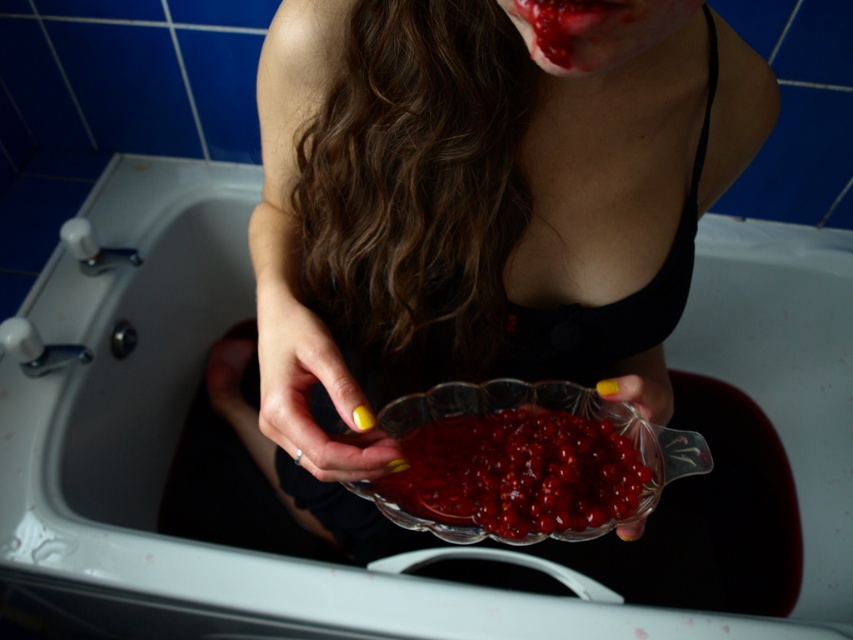
You are an interior designer working on a bathroom renovation project. You want to place a glossy glass bowl at center in the bathroom. Based on the scene description, where should you position it?

You should position the glossy glass bowl at center at point (517, 476).

You are a photographer setting up a shoot in this bathroom scene. You need to position a light source to illuminate the transparent glass bowl at center and the glossy plastic face at upper center. Based on their positions, where should you place the light source relative to these two objects to ensure both are well lit?

The transparent glass bowl at center is located below the glossy plastic face at upper center. To ensure both are well lit, position the light source above the glossy plastic face at upper center so that it illuminates both the face and the bowl below it.

You are an interior designer analyzing the bathroom layout. The glossy glass bowl at center is placed at point (517,476). If you want to place a decorative item exactly 0.1 units to the right of the glossy glass bowl at center, what coordinate would you use?

To place a decorative item exactly 0.1 units to the right of the glossy glass bowl at center located at point (517,476), you would adjust the x coordinate by adding 0.1. The new coordinate would be 0.844, 0.607.